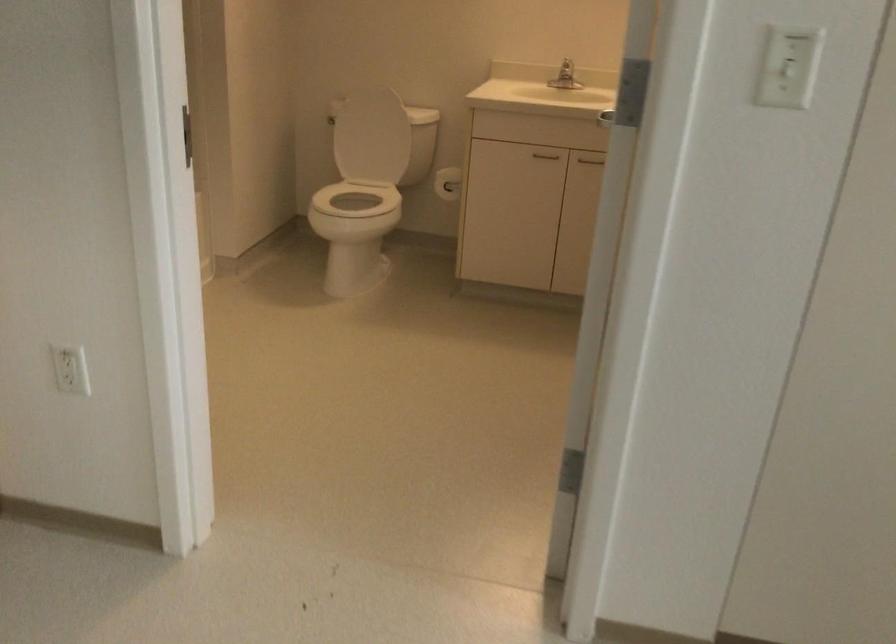
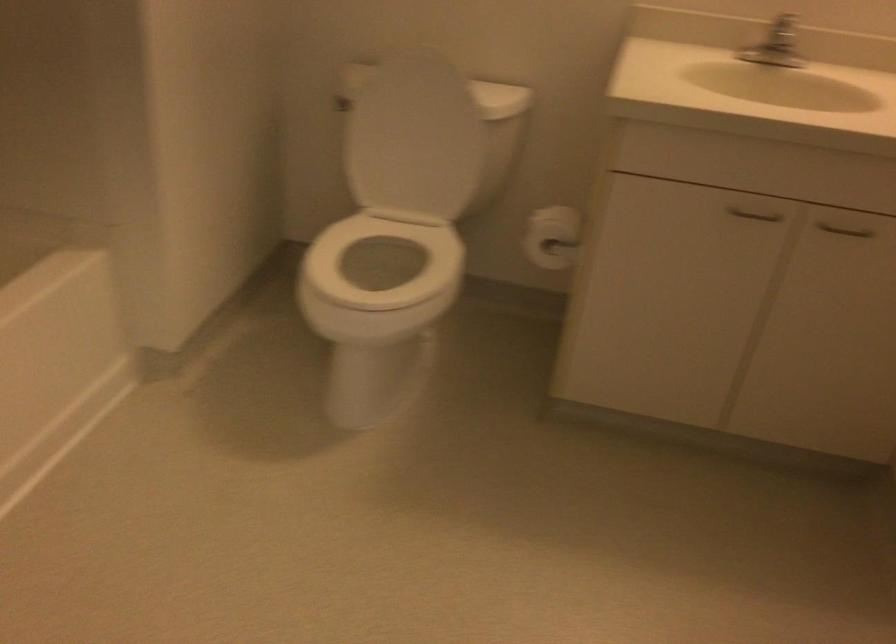
Question: Which direction would the cameraman need to move to produce the second image? Reply with the corresponding letter.

Choices:
 (A) Left
 (B) Right
 (C) Forward
 (D) Backward

Answer: (C)